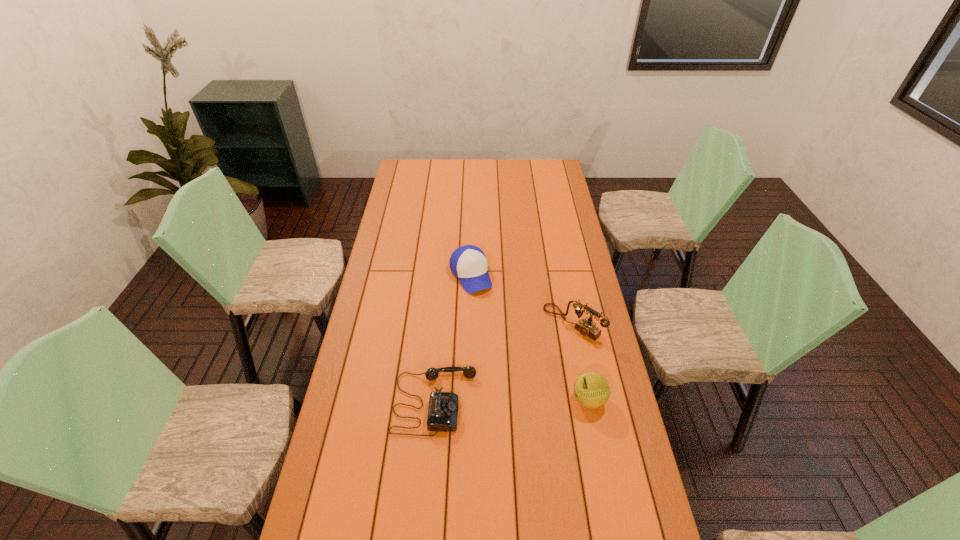
The image size is (960, 540). Identify the location of vacant area at the left edge of the desktop. (389, 302).

Locate an element on the screen. The width and height of the screenshot is (960, 540). blank area at the right edge is located at coordinates (573, 212).

The width and height of the screenshot is (960, 540). What are the coordinates of `vacant space at the near left corner of the desktop` in the screenshot? It's located at (314, 512).

The image size is (960, 540). Find the location of `free space at the far right corner of the desktop`. free space at the far right corner of the desktop is located at coordinates (558, 163).

The image size is (960, 540). Find the location of `free space between the softball and the farthest object`. free space between the softball and the farthest object is located at coordinates (530, 337).

This screenshot has height=540, width=960. I want to click on free point between the softball and the farthest object, so click(530, 337).

This screenshot has height=540, width=960. What are the coordinates of `free space between the softball and the farthest object` in the screenshot? It's located at (530, 337).

Locate an element on the screen. The image size is (960, 540). vacant space that is in between the right telephone and the softball is located at coordinates (581, 361).

The height and width of the screenshot is (540, 960). In order to click on empty location between the baseball cap and the nearer telephone in this screenshot , I will do [453, 338].

You are a GUI agent. You are given a task and a screenshot of the screen. Output one action in this format:
    pyautogui.click(x=<x>, y=<y>)
    Task: Click on the vacant space that is in between the farther telephone and the softball
    The image size is (960, 540).
    Given the screenshot: What is the action you would take?
    pyautogui.click(x=581, y=361)